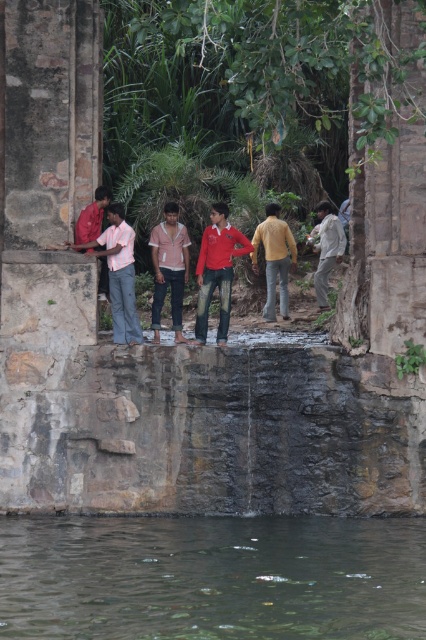
You are a photographer trying to capture the group near the old stone structure. You want to ensure both the striped cotton shirt at left and the matte yellow shirt at center are clearly visible in your photo. Which shirt should you focus on first to ensure both are in focus?

You should focus on the striped cotton shirt at left first because it is closer to the viewer than the matte yellow shirt at center. By focusing on the closer object, the depth of field may extend to include the matte yellow shirt at center as well.

You are a photographer trying to capture a group photo of the matte yellow shirt at center and the light beige fabric shirt at right. Since you want to ensure both subjects are in focus, you need to know their relative heights. Which of the two shirts is taller?

The matte yellow shirt at center is taller than the light beige fabric shirt at right according to the description.